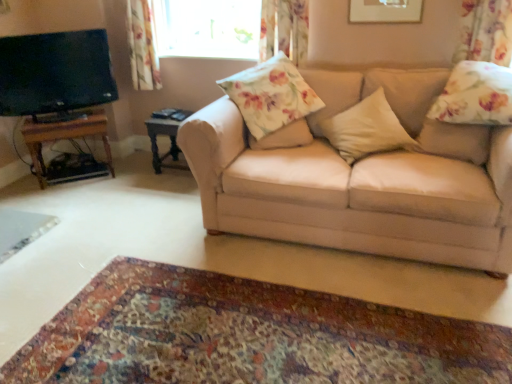
Question: Is matte black tv at left outside wooden table at left, which appears as the 1th table when viewed from the left?

Choices:
 (A) yes
 (B) no

Answer: (A)

Question: Is matte black tv at left turned away from wooden table at left, which ranks as the 2th table in right-to-left order?

Choices:
 (A) no
 (B) yes

Answer: (A)

Question: Is matte black tv at left at the right side of wooden table at left, which ranks as the 2th table in right-to-left order?

Choices:
 (A) yes
 (B) no

Answer: (B)

Question: Is matte black tv at left with wooden table at left, which appears as the 1th table when viewed from the left?

Choices:
 (A) no
 (B) yes

Answer: (A)

Question: Can you confirm if matte black tv at left is wider than wooden table at left, which appears as the 1th table when viewed from the left?

Choices:
 (A) yes
 (B) no

Answer: (B)

Question: Does matte black tv at left come behind wooden table at left, which ranks as the 2th table in right-to-left order?

Choices:
 (A) yes
 (B) no

Answer: (B)

Question: Can you confirm if floral fabric pillow at center, marked as the first pillow in a left-to-right arrangement, is taller than floral fabric pillow at center?

Choices:
 (A) no
 (B) yes

Answer: (A)

Question: Does floral fabric pillow at center, the third pillow when ordered from right to left, have a greater width compared to floral fabric pillow at center?

Choices:
 (A) no
 (B) yes

Answer: (A)

Question: Does floral fabric pillow at center, marked as the first pillow in a left-to-right arrangement, have a lesser width compared to floral fabric pillow at center?

Choices:
 (A) yes
 (B) no

Answer: (A)

Question: Is floral fabric pillow at center, marked as the first pillow in a left-to-right arrangement, positioned beyond the bounds of floral fabric pillow at center?

Choices:
 (A) no
 (B) yes

Answer: (A)

Question: From the image's perspective, is floral fabric pillow at center, the third pillow when ordered from right to left, under floral fabric pillow at center?

Choices:
 (A) no
 (B) yes

Answer: (B)

Question: Is there a large distance between floral fabric pillow at center, the third pillow when ordered from right to left, and floral fabric pillow at center?

Choices:
 (A) yes
 (B) no

Answer: (B)

Question: Is floral fabric curtain at upper left, the 1th curtain from the back, bigger than transparent glass window at upper center?

Choices:
 (A) no
 (B) yes

Answer: (B)